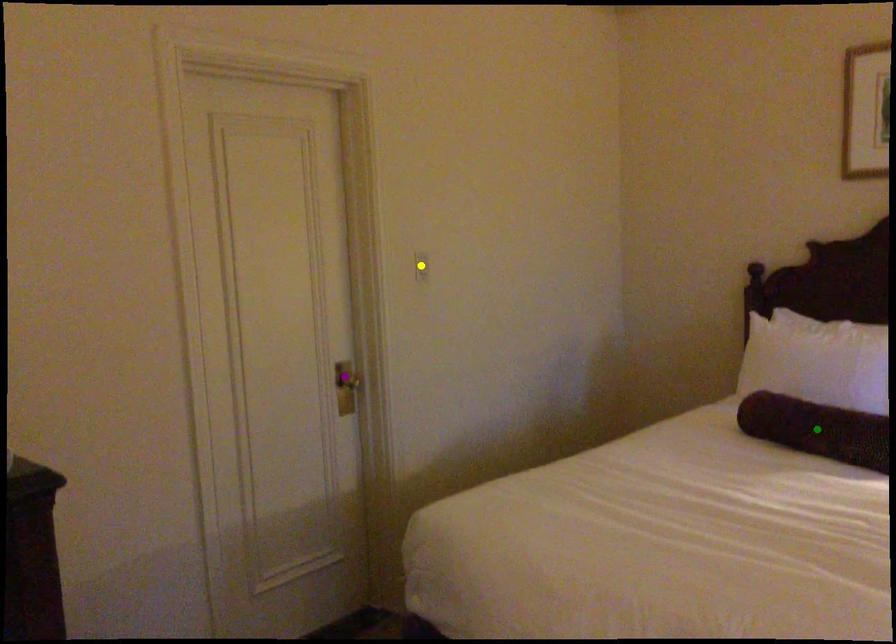
Order these from nearest to farthest:
green point, purple point, yellow point

green point → purple point → yellow point